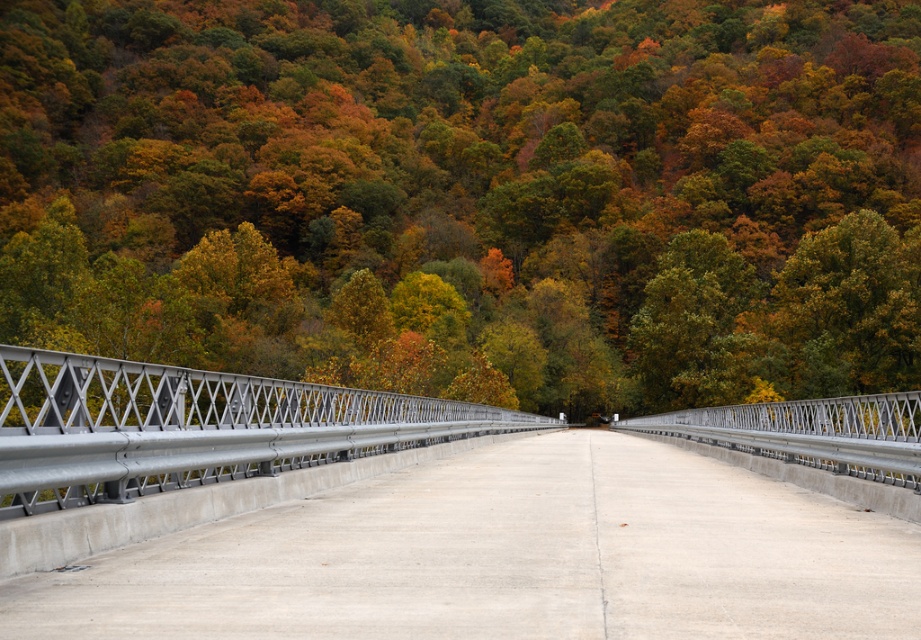
From the picture: You are a delivery truck driver planning to cross the metallic gray highway at center. You notice a green matte tree at center in the middle of the highway. Can your truck safely pass around the tree without hitting it?

The metallic gray highway at center is narrower than the green matte tree at center, so the tree is too wide for the highway. Therefore, the truck cannot safely pass around the tree without hitting it.

You are driving a car and see the metallic gray highway at center and the green matte tree at center. Which one is positioned to the left from your perspective?

The metallic gray highway at center is positioned to the left of the green matte tree at center.